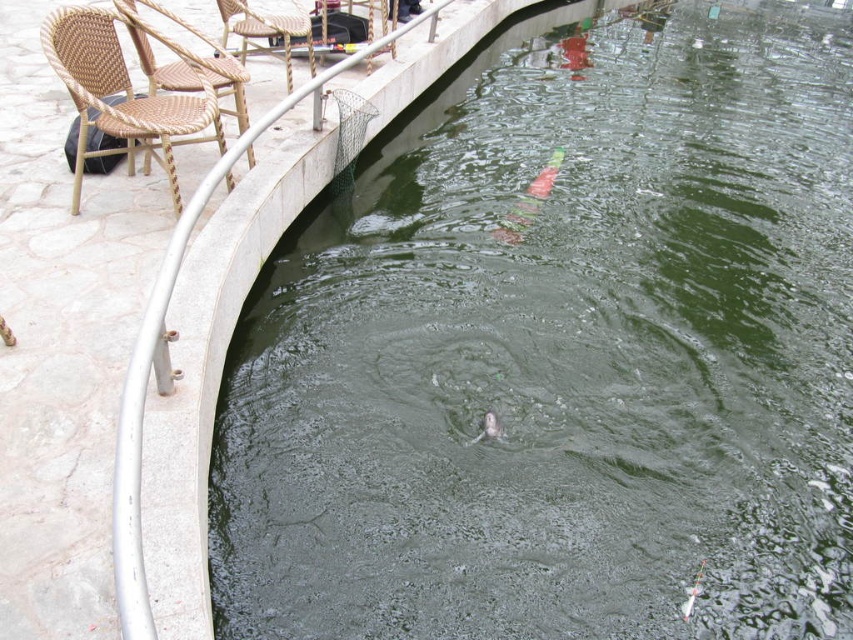
You are standing near the water feature and want to place a small decorative item between the woven rattan chair at upper left and the shiny silver fish at center. Based on their positions, which object is closer to you, and can you safely place the item without it falling into the water?

The woven rattan chair at upper left is closer to you than the shiny silver fish at center. Since the chair is closer, placing the item between them would mean positioning it near the chair, which is on the paved area. This should be safe as the chair is on solid ground, so the item won

You are sitting on the woven wicker chair at upper left and want to place your black bag on the woven rattan chair at left. Is the black bag currently within reach of your arm without moving from the chair?

The woven rattan chair at left is positioned on the left side of the woven wicker chair at upper left, meaning the black bag on the ground near the woven rattan chair at left would require you to stretch your arm across to reach it. Since the distance between the two chairs isn